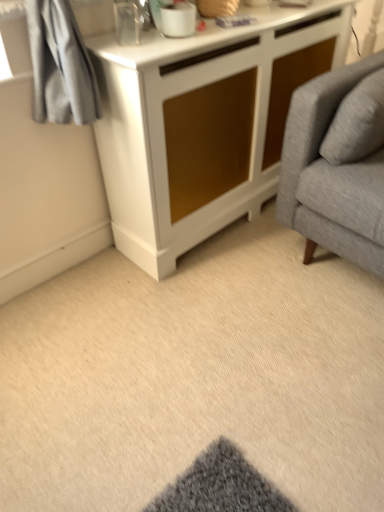
Question: Can you confirm if beige carpet at lower center is positioned to the left of white textured cabinet at center?

Choices:
 (A) yes
 (B) no

Answer: (A)

Question: From the image's perspective, would you say beige carpet at lower center is shown under white textured cabinet at center?

Choices:
 (A) yes
 (B) no

Answer: (A)

Question: Is beige carpet at lower center taller than white textured cabinet at center?

Choices:
 (A) no
 (B) yes

Answer: (A)

Question: Is beige carpet at lower center at the right side of white textured cabinet at center?

Choices:
 (A) yes
 (B) no

Answer: (B)

Question: Considering the relative sizes of beige carpet at lower center and white textured cabinet at center in the image provided, is beige carpet at lower center shorter than white textured cabinet at center?

Choices:
 (A) yes
 (B) no

Answer: (A)

Question: Is white textured cabinet at center to the left or to the right of white glossy mug at upper center in the image?

Choices:
 (A) left
 (B) right

Answer: (B)

Question: Is point (167, 145) closer or farther from the camera than point (155, 9)?

Choices:
 (A) closer
 (B) farther

Answer: (B)

Question: In the image, is white textured cabinet at center positioned in front of or behind white glossy mug at upper center?

Choices:
 (A) front
 (B) behind

Answer: (A)

Question: Based on their sizes in the image, would you say white textured cabinet at center is bigger or smaller than white glossy mug at upper center?

Choices:
 (A) big
 (B) small

Answer: (A)

Question: Which is correct: white glossy mug at upper center is inside beige carpet at lower center, or outside of it?

Choices:
 (A) inside
 (B) outside

Answer: (B)

Question: From their relative heights in the image, would you say white glossy mug at upper center is taller or shorter than beige carpet at lower center?

Choices:
 (A) short
 (B) tall

Answer: (B)

Question: Is white glossy mug at upper center to the left or to the right of beige carpet at lower center in the image?

Choices:
 (A) left
 (B) right

Answer: (A)

Question: From the image's perspective, is white glossy mug at upper center positioned above or below beige carpet at lower center?

Choices:
 (A) above
 (B) below

Answer: (A)

Question: Considering the positions of beige carpet at lower center and white glossy mug at upper center in the image, is beige carpet at lower center taller or shorter than white glossy mug at upper center?

Choices:
 (A) tall
 (B) short

Answer: (B)

Question: Based on their sizes in the image, would you say beige carpet at lower center is bigger or smaller than white glossy mug at upper center?

Choices:
 (A) big
 (B) small

Answer: (A)